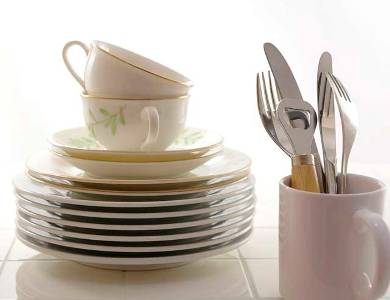
If there are any how many total plates present in the image, indicate their positions. Your answer should be formatted as a list of tuples, i.e. [(x1, y1), (x2, y2), ...], where each tuple contains the x and y coordinates of a point satisfying the conditions above.

[(103, 260), (105, 249), (105, 238), (106, 227), (108, 215), (111, 202), (117, 193), (122, 182)]